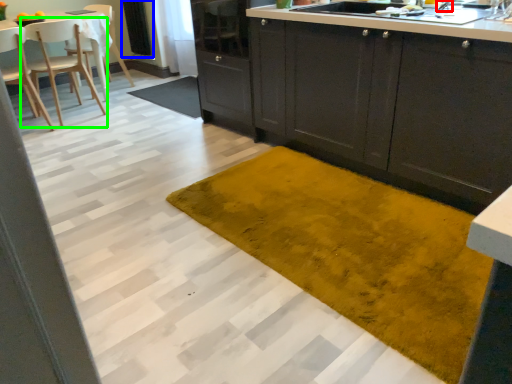
Question: Estimate the real-world distances between objects in this image. Which object is farther from faucet (highlighted by a red box), screen door (highlighted by a blue box) or chair (highlighted by a green box)?

Choices:
 (A) screen door
 (B) chair

Answer: (A)